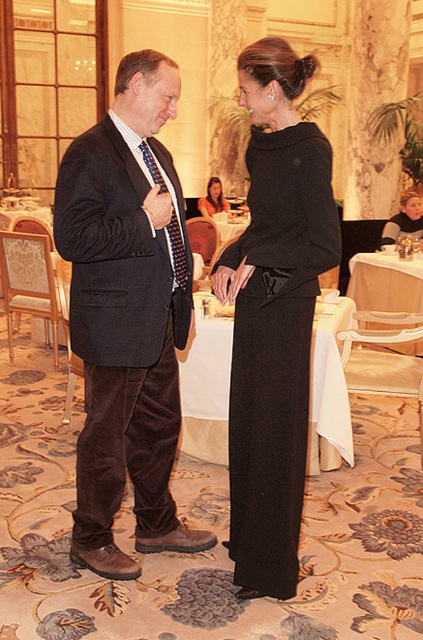
Question: Which is nearer to the velvet black suit at center?

Choices:
 (A) white fabric table at center
 (B) matte black dress at center
 (C) black satin dress at center
 (D) black wool dress at center

Answer: (D)

Question: Can you confirm if white fabric table at center is smaller than matte black dress at center?

Choices:
 (A) yes
 (B) no

Answer: (B)

Question: Which point appears closest to the camera in this image?

Choices:
 (A) (403, 204)
 (B) (200, 202)

Answer: (A)

Question: Is velvet black suit at center in front of blue textured tie at center?

Choices:
 (A) yes
 (B) no

Answer: (A)

Question: Can you confirm if velvet black suit at center is positioned to the left of blue textured tie at center?

Choices:
 (A) no
 (B) yes

Answer: (B)

Question: Which is nearer to the blue textured tie at center?

Choices:
 (A) matte black dress at center
 (B) black satin dress at center
 (C) velvet black suit at center
 (D) black wool dress at center

Answer: (C)